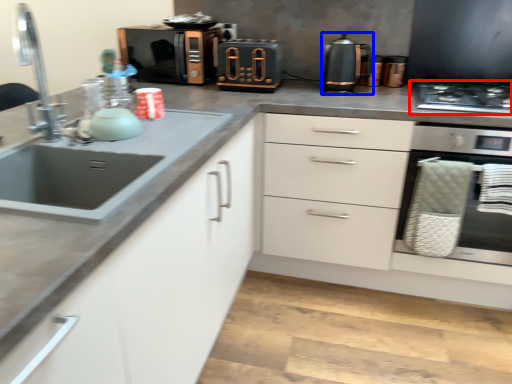
Question: Which object appears closest to the camera in this image, gas stove (highlighted by a red box) or kitchen appliance (highlighted by a blue box)?

Choices:
 (A) gas stove
 (B) kitchen appliance

Answer: (A)